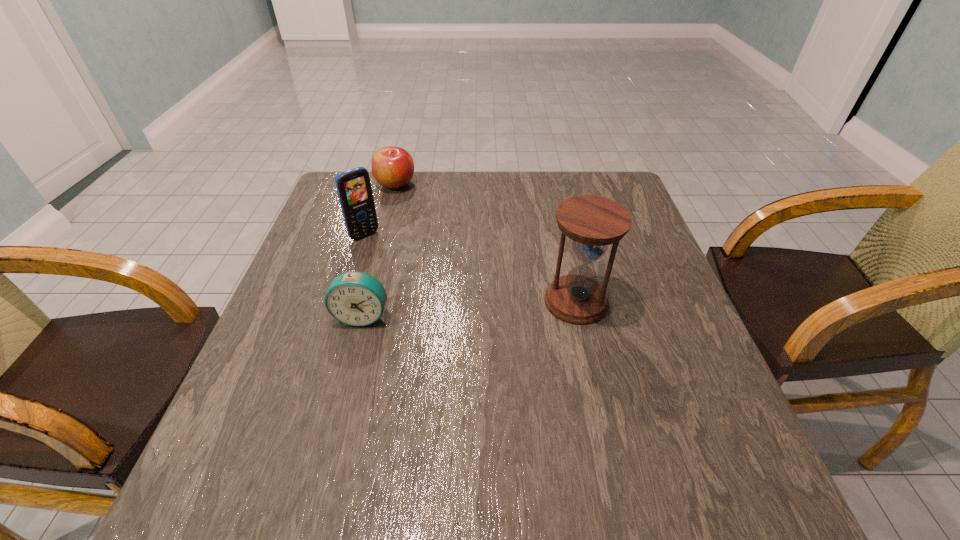
Locate an element on the screen. This screenshot has width=960, height=540. free space on the desktop that is between the alarm clock and the hourglass and is positioned on the screen of the second farthest object is located at coordinates (440, 310).

Identify the location of vacant space on the desktop that is between the alarm clock and the hourglass and is positioned on the stem of the apple. The image size is (960, 540). (500, 307).